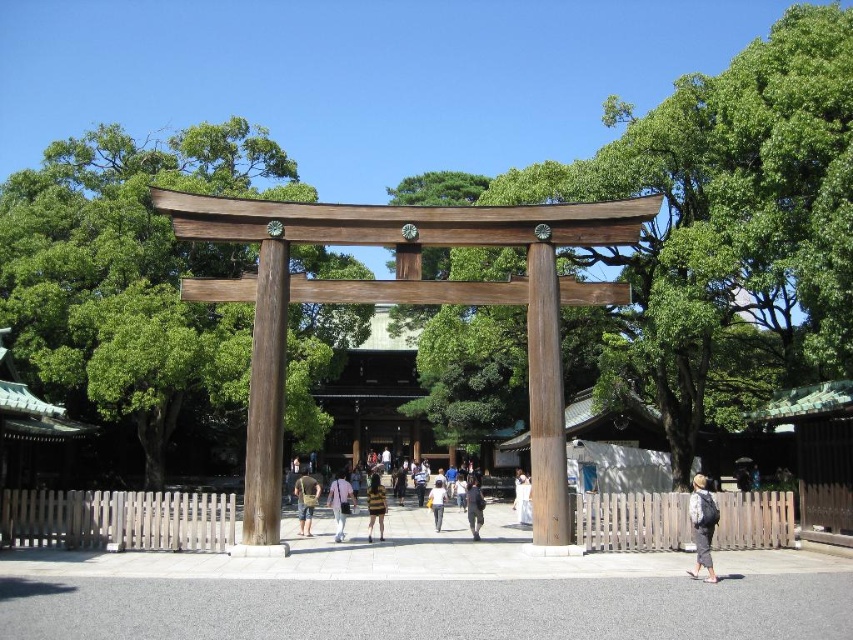
Is point (372, 476) farther from camera compared to point (434, 518)?

Yes, point (372, 476) is farther from viewer.

Between point (370, 476) and point (440, 506), which one is positioned in front?

Point (440, 506) is in front.

Describe the element at coordinates (375, 506) in the screenshot. I see `striped fabric shirt at center` at that location.

I want to click on striped fabric shirt at center, so click(375, 506).

Is point (705, 497) positioned behind point (351, 502)?

No, it is in front of (351, 502).

Is light brown backpack at lower right wider than light brown wooden post at center?

Correct, the width of light brown backpack at lower right exceeds that of light brown wooden post at center.

Where is `light brown backpack at lower right`? light brown backpack at lower right is located at coordinates (701, 525).

In the scene shown: Can you confirm if light brown backpack at lower right is positioned above striped fabric shirt at center?

Yes.

Looking at this image, between light brown backpack at lower right and striped fabric shirt at center, which one is positioned higher?

light brown backpack at lower right is higher up.

Where is `light brown backpack at lower right`? This screenshot has height=640, width=853. light brown backpack at lower right is located at coordinates (701, 525).

At what (x,y) coordinates should I click in order to perform the action: click on light brown backpack at lower right. Please return your answer as a coordinate pair (x, y). The height and width of the screenshot is (640, 853). Looking at the image, I should click on pyautogui.click(x=701, y=525).